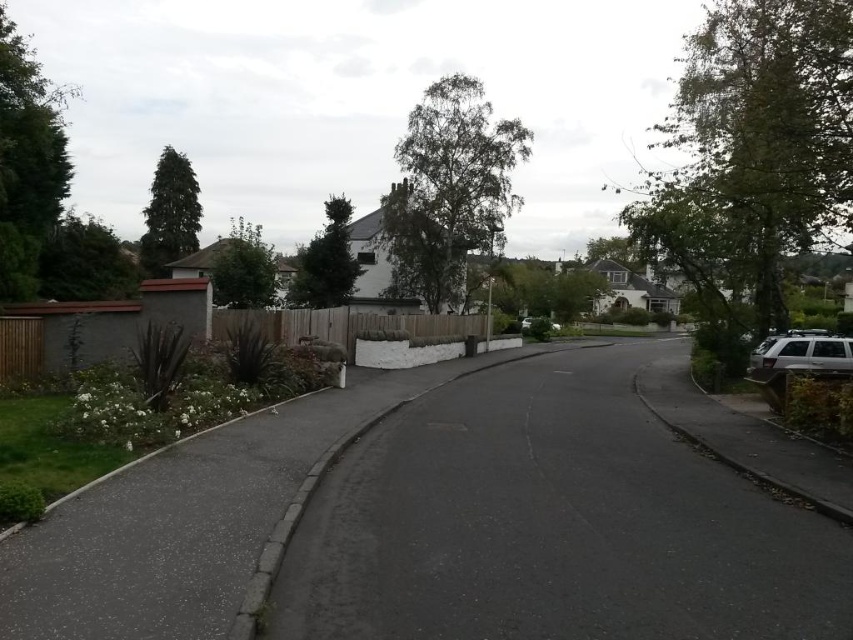
Where is `black asphalt driveway at center`? The image size is (853, 640). black asphalt driveway at center is located at coordinates (552, 524).

Where is `black asphalt driveway at center`? This screenshot has width=853, height=640. black asphalt driveway at center is located at coordinates (552, 524).

Can you confirm if green leafy tree at upper left is wider than green matte tree at upper left?

No, green leafy tree at upper left is not wider than green matte tree at upper left.

Which is in front, point (45, 252) or point (178, 248)?

Point (45, 252)

Where is `green leafy tree at upper left`? green leafy tree at upper left is located at coordinates (85, 262).

Does green leafy tree at upper center appear under white matte car at center?

Incorrect, green leafy tree at upper center is not positioned below white matte car at center.

Does green leafy tree at upper center have a smaller size compared to white matte car at center?

Incorrect, green leafy tree at upper center is not smaller in size than white matte car at center.

Describe the element at coordinates (242, 268) in the screenshot. I see `green leafy tree at upper center` at that location.

In order to click on green leafy tree at upper center in this screenshot , I will do `click(242, 268)`.